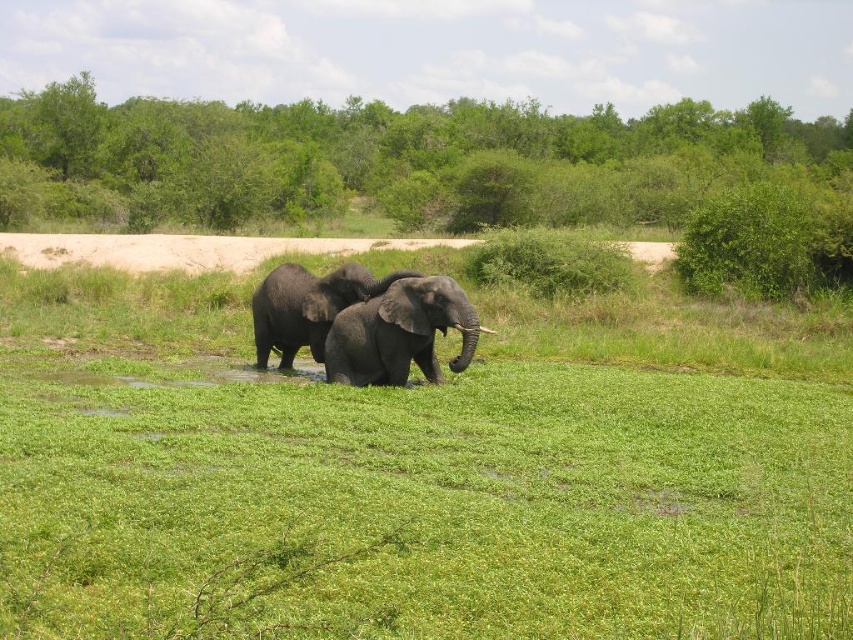
You are a wildlife photographer aiming to capture a clear photo of both the shiny black elephant at center and the shiny gray elephant at center. Since you want to focus on the one closer to you, which elephant should you focus on?

The shiny black elephant at center is closer to the viewer than the shiny gray elephant at center, so you should focus on the shiny black elephant at center.

You are a photographer standing at the edge of the grassy terrain. You want to take a photo of the shiny black elephant at center and the green grassy at center. Based on their positions, which object should appear lower in the photo?

The green grassy at center is located below the shiny black elephant at center, so in the photo, the green grassy at center will appear lower than the shiny black elephant at center.

You are a wildlife photographer aiming to capture a photo of both the shiny black elephant at center and the shiny gray elephant at center. Since you want to ensure both elephants are clearly visible in the frame, which elephant should you focus on first to account for their sizes?

The shiny black elephant at center is shorter than the shiny gray elephant at center, so you should focus on the shiny gray elephant at center first as it is taller and may require more attention to ensure it is fully in frame.